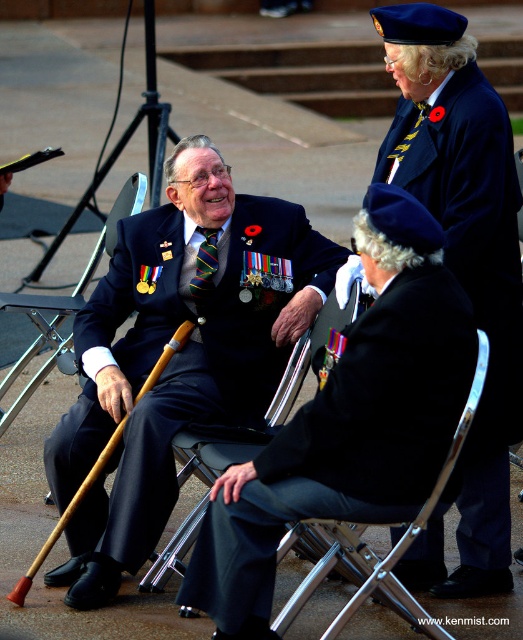
You are organizing a photo shoot for a magazine article about veterans. You need to ensure that the wooden cane at lower left and the striped fabric tie at center are both visible in the photo. Given their sizes, which object should you focus on to ensure it doesn t get lost in the composition?

The wooden cane at lower left is larger in size than the striped fabric tie at center. Therefore, you should focus on ensuring the striped fabric tie at center is prominent to prevent it from being overshadowed by the larger cane.

You are organizing a military ceremony and need to place the velvet blue beret at upper right and the wooden cane at lower left on a display table. The table has limited space. Which object requires more space due to its size?

The velvet blue beret at upper right requires more space because it has a larger size compared to the wooden cane at lower left.

You are attending a formal outdoor event and notice two items of clothing in the image. The black fabric uniform at center and the velvet blue beret at upper right. Which item is located lower in the image?

The black fabric uniform at center is positioned under the velvet blue beret at upper right, so the black fabric uniform at center is lower in the image.